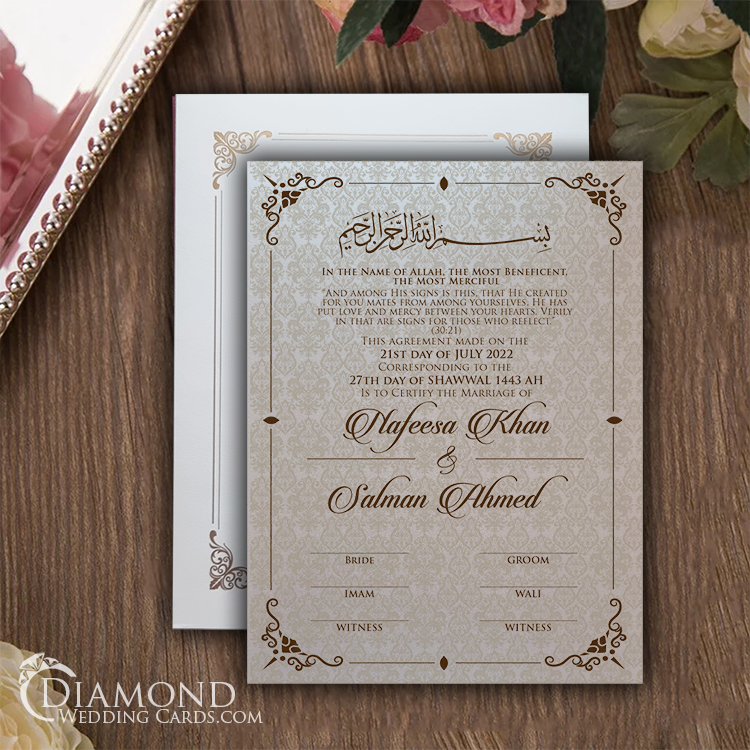
Locate an element on the screen. The width and height of the screenshot is (750, 750). table is located at coordinates (85, 450), (694, 616).